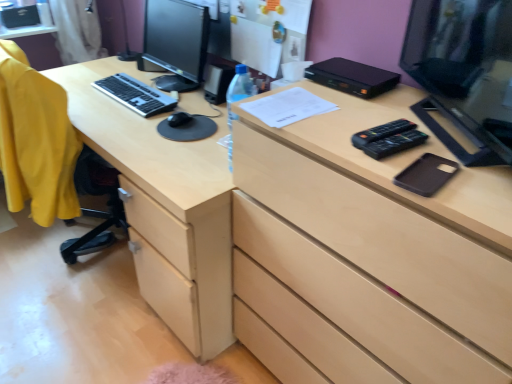
The height and width of the screenshot is (384, 512). Identify the location of vacant space situated on the left part of silver metallic keyboard at center-left. (85, 85).